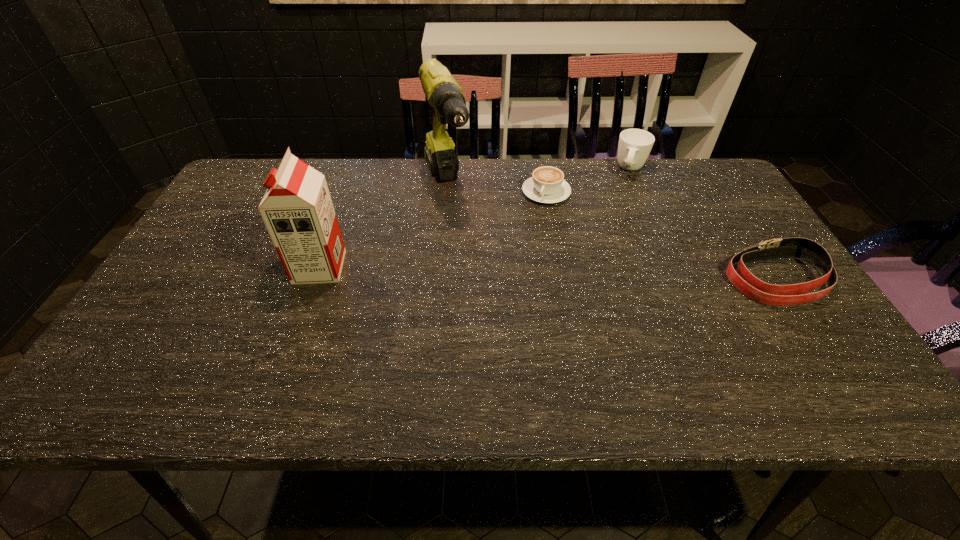
Identify the location of vacant space located on the side of the third object from right to left with the handle. This screenshot has height=540, width=960. (504, 275).

Where is `blank area located on the side of the third object from right to left with the handle`? This screenshot has height=540, width=960. blank area located on the side of the third object from right to left with the handle is located at coordinates (519, 245).

Identify the location of vacant region located on the side of the third object from right to left with the handle. The width and height of the screenshot is (960, 540). (489, 303).

What are the coordinates of `vacant space positioned on the handle side of the fourth object from right to left` in the screenshot? It's located at (464, 247).

Identify the location of vacant space located on the handle side of the fourth object from right to left. The image size is (960, 540). click(x=456, y=231).

You are a GUI agent. You are given a task and a screenshot of the screen. Output one action in this format:
    pyautogui.click(x=<x>, y=<y>)
    Task: Click on the blank space located on the handle side of the fourth object from right to left
    
    Given the screenshot: What is the action you would take?
    pyautogui.click(x=482, y=291)

At what (x,y) coordinates should I click in order to perform the action: click on free space located 0.190m with the handle on the side of the fourth object from left to right. Please return your answer as a coordinate pair (x, y). Looking at the image, I should click on (617, 217).

Locate an element on the screen. vacant region located 0.270m with the handle on the side of the fourth object from left to right is located at coordinates (612, 234).

At what (x,y) coordinates should I click in order to perform the action: click on vacant space located 0.380m with the handle on the side of the fourth object from left to right. Please return your answer as a coordinate pair (x, y). The height and width of the screenshot is (540, 960). Looking at the image, I should click on (604, 260).

Find the location of a particular element. The width and height of the screenshot is (960, 540). cappuccino located at the far edge is located at coordinates pos(547,185).